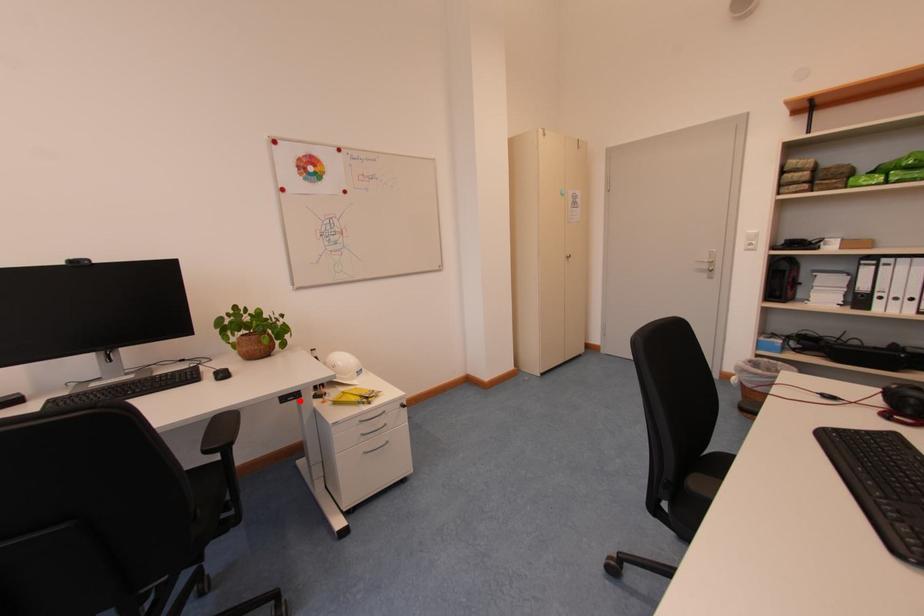
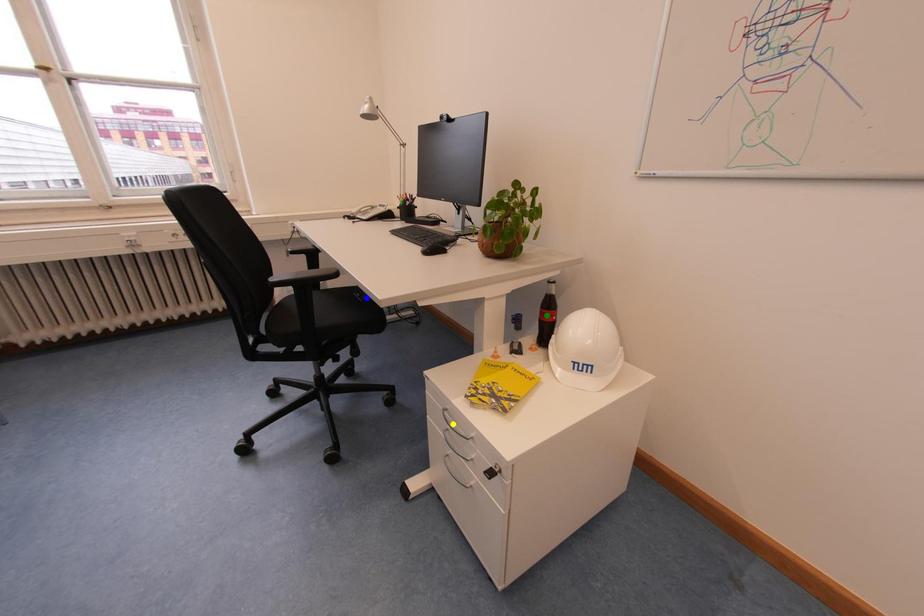
Question: I am providing you with two images of the same scene from different viewpoints. A red point is marked on the first image. You are given multiple points on the second image. Which mark in image 2 goes with the point in image 1?

Choices:
 (A) yellow point
 (B) green point
 (C) blue point

Answer: (C)